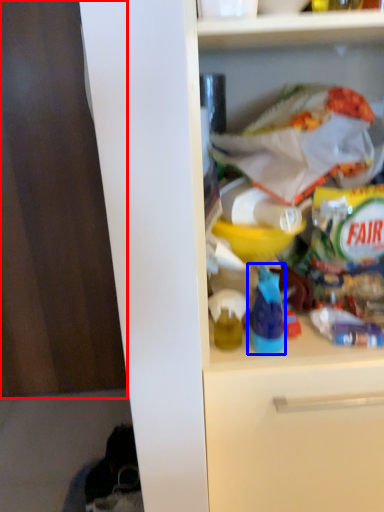
Question: Which point is closer to the camera, leftover (highlighted by a red box) or bottle (highlighted by a blue box)?

Choices:
 (A) leftover
 (B) bottle

Answer: (B)